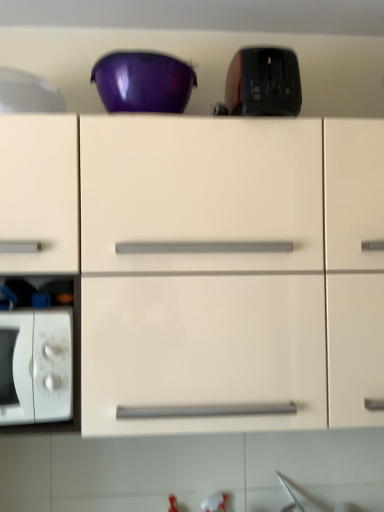
Question: Is white glossy microwave at left, which is the 2th appliance from right to left, bigger or smaller than black glossy toaster at upper center, which is the first appliance in right-to-left order?

Choices:
 (A) small
 (B) big

Answer: (A)

Question: From a real-world perspective, is white glossy microwave at left, marked as the first appliance in a left-to-right arrangement, physically located above or below black glossy toaster at upper center, the second appliance positioned from the left?

Choices:
 (A) above
 (B) below

Answer: (A)

Question: Considering the real-world distances, which object is farthest from the white glossy microwave at left, which is the 2th appliance from right to left?

Choices:
 (A) black glossy toaster at upper center, which is the first appliance in right-to-left order
 (B) white matte microwave oven at lower left
 (C) matte white cabinet at center
 (D) glossy plastic bowl at upper center

Answer: (B)

Question: Which object is positioned farthest from the black glossy toaster at upper center, the second appliance positioned from the left?

Choices:
 (A) white matte microwave oven at lower left
 (B) matte white cabinet at center
 (C) white glossy microwave at left, which is the 2th appliance from right to left
 (D) glossy plastic bowl at upper center

Answer: (A)